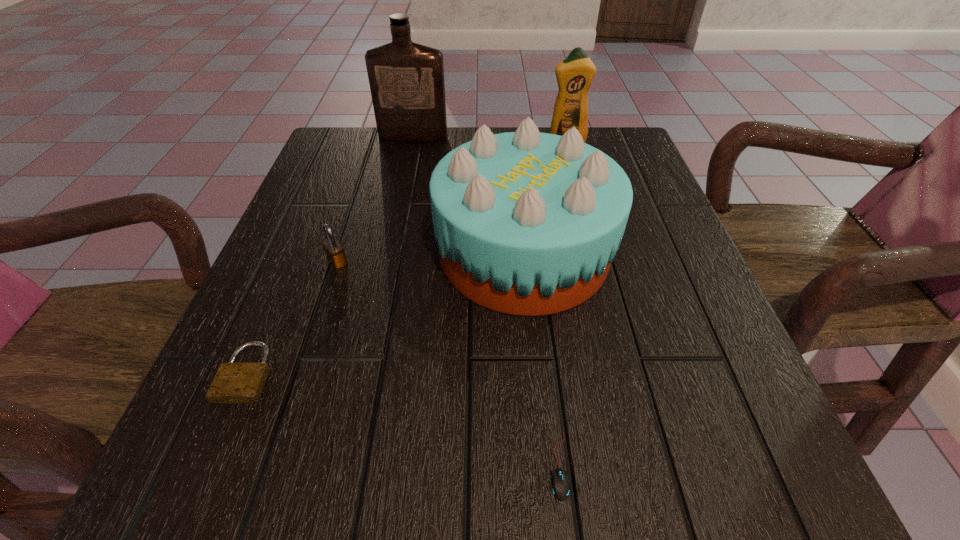
Where is `cake positioned at the right edge`? cake positioned at the right edge is located at coordinates (527, 223).

Where is `object that is at the far left corner`? The image size is (960, 540). object that is at the far left corner is located at coordinates (406, 79).

Identify the location of object that is at the far right corner. (575, 73).

This screenshot has height=540, width=960. In order to click on free space at the far edge in this screenshot , I will do `click(428, 163)`.

This screenshot has width=960, height=540. What are the coordinates of `free region at the near edge of the desktop` in the screenshot? It's located at (592, 507).

In the image, there is a desktop. Identify the location of vacant space at the left edge. (311, 199).

Locate an element on the screen. The height and width of the screenshot is (540, 960). vacant space at the right edge is located at coordinates (665, 246).

In order to click on free space at the far left corner of the desktop in this screenshot , I will do `click(324, 143)`.

The width and height of the screenshot is (960, 540). In the image, there is a desktop. Find the location of `vacant space at the near left corner`. vacant space at the near left corner is located at coordinates (239, 471).

Locate an element on the screen. This screenshot has width=960, height=540. free space at the far right corner of the desktop is located at coordinates (612, 127).